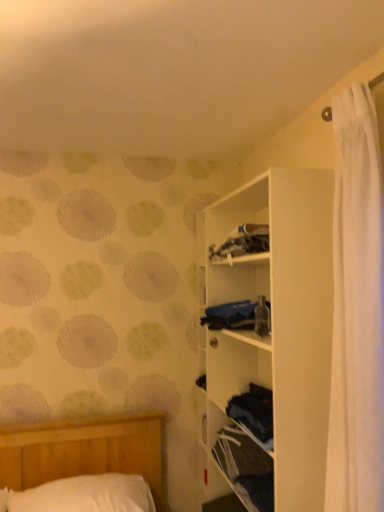
Question: Is white matte shelf at upper right turned away from blue fabric at center?

Choices:
 (A) yes
 (B) no

Answer: (A)

Question: Can you confirm if white matte shelf at upper right is positioned to the left of blue fabric at center?

Choices:
 (A) yes
 (B) no

Answer: (B)

Question: Is white matte shelf at upper right closer to the viewer compared to blue fabric at center?

Choices:
 (A) yes
 (B) no

Answer: (A)

Question: Is white matte shelf at upper right bigger than blue fabric at center?

Choices:
 (A) yes
 (B) no

Answer: (A)

Question: Is white matte shelf at upper right outside of blue fabric at center?

Choices:
 (A) no
 (B) yes

Answer: (B)

Question: Does white matte shelf at upper right contain blue fabric at center?

Choices:
 (A) yes
 (B) no

Answer: (A)

Question: From the image's perspective, is white matte shelf at upper right above white soft pillow at lower left?

Choices:
 (A) no
 (B) yes

Answer: (B)

Question: Can you confirm if white matte shelf at upper right is positioned to the right of white soft pillow at lower left?

Choices:
 (A) yes
 (B) no

Answer: (A)

Question: Is white matte shelf at upper right aimed at white soft pillow at lower left?

Choices:
 (A) yes
 (B) no

Answer: (A)

Question: Is the surface of white matte shelf at upper right in direct contact with white soft pillow at lower left?

Choices:
 (A) no
 (B) yes

Answer: (A)

Question: Is white matte shelf at upper right positioned with its back to white soft pillow at lower left?

Choices:
 (A) no
 (B) yes

Answer: (A)

Question: Considering the relative sizes of white matte shelf at upper right and white soft pillow at lower left in the image provided, is white matte shelf at upper right smaller than white soft pillow at lower left?

Choices:
 (A) yes
 (B) no

Answer: (B)

Question: Is the position of blue fabric at center less distant than that of white matte shelf at upper right?

Choices:
 (A) yes
 (B) no

Answer: (B)